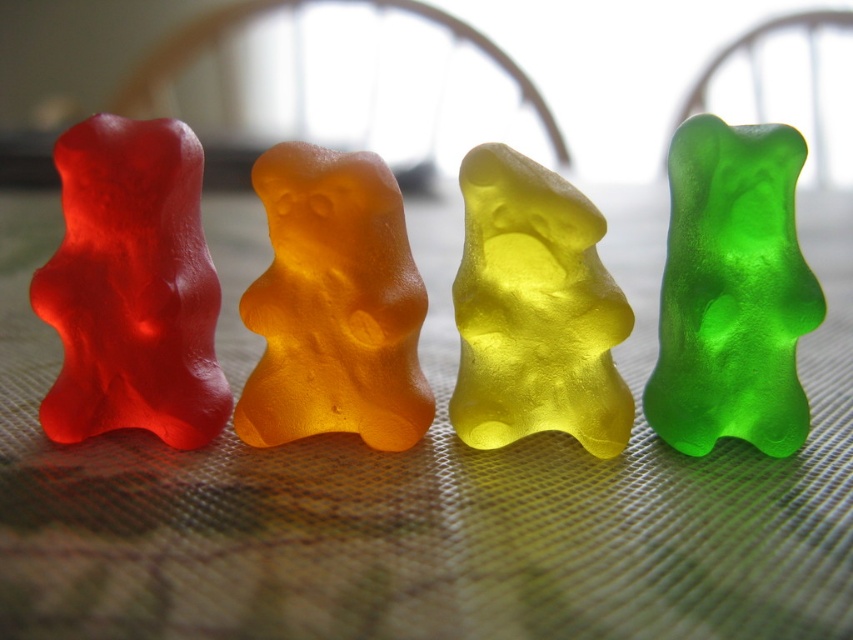
Question: Which point is closer to the camera?

Choices:
 (A) (190, 403)
 (B) (494, 148)
 (C) (415, 333)

Answer: (B)

Question: Is matte translucent gummy bear at left below green translucent gummy bear at right?

Choices:
 (A) yes
 (B) no

Answer: (B)

Question: Which point appears farthest from the camera in this image?

Choices:
 (A) (554, 381)
 (B) (274, 234)

Answer: (A)

Question: Which point is closer to the camera?

Choices:
 (A) translucent orange gummy bear at center
 (B) yellow translucent gummy bear at center

Answer: (B)

Question: Can you confirm if translucent orange gummy bear at center is positioned to the left of green translucent gummy bear at right?

Choices:
 (A) no
 (B) yes

Answer: (B)

Question: Does translucent orange gummy bear at center appear on the left side of yellow translucent gummy bear at center?

Choices:
 (A) yes
 (B) no

Answer: (A)